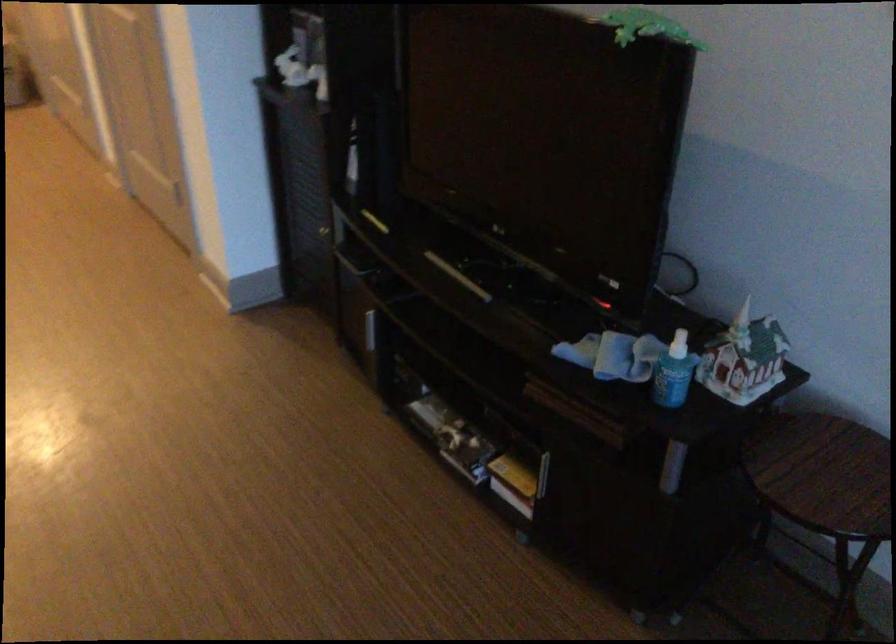
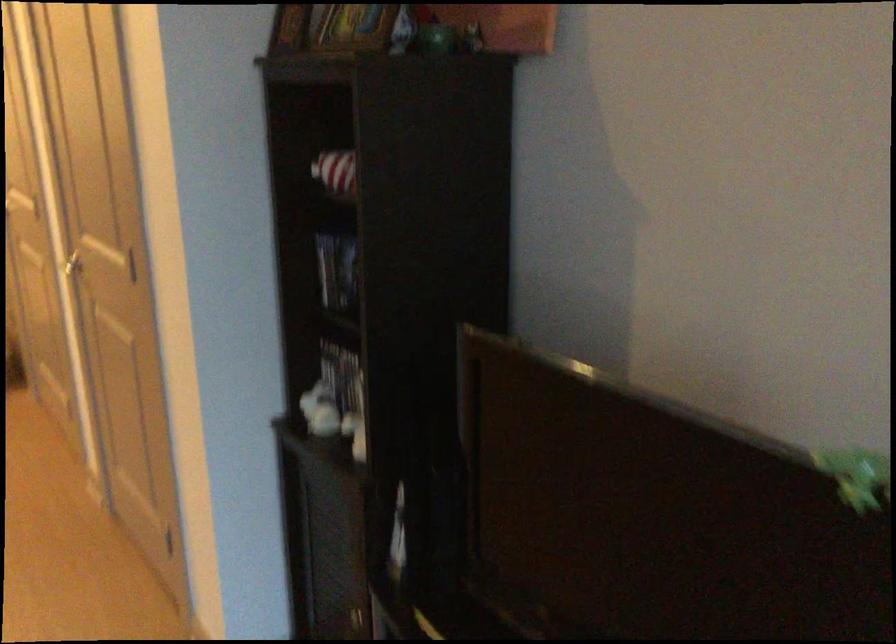
Question: The images are taken continuously from a first-person perspective. In which direction is your viewpoint rotating?

Choices:
 (A) Left
 (B) Right
 (C) Up
 (D) Down

Answer: (C)